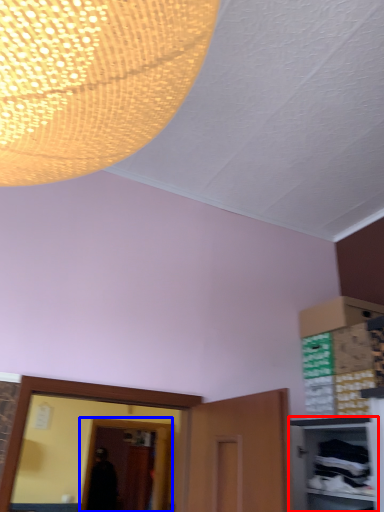
Question: Which object is further to the camera taking this photo, cabinetry (highlighted by a red box) or glass door (highlighted by a blue box)?

Choices:
 (A) cabinetry
 (B) glass door

Answer: (B)